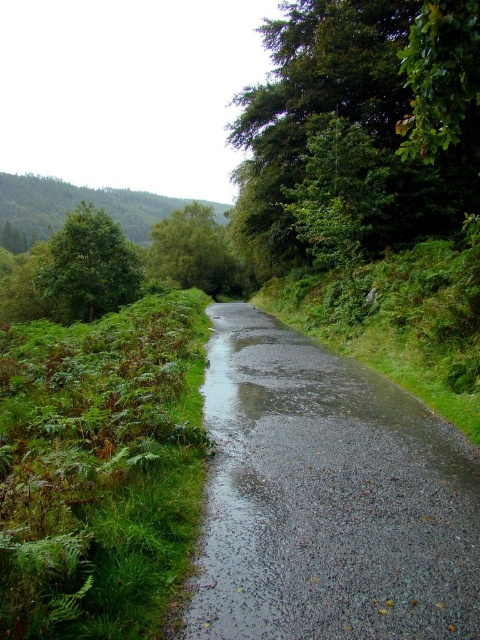
Question: Is green leafy tree at upper right further to camera compared to green leafy tree at center?

Choices:
 (A) yes
 (B) no

Answer: (B)

Question: Does glossy asphalt road at center come behind green leafy tree at left?

Choices:
 (A) no
 (B) yes

Answer: (A)

Question: Which object is farther from the camera taking this photo?

Choices:
 (A) green leafy tree at center
 (B) green leafy tree at left
 (C) green leafy tree at upper right
 (D) glossy asphalt road at center

Answer: (A)

Question: Which point is closer to the camera taking this photo?

Choices:
 (A) (396, 4)
 (B) (58, 246)
 (C) (189, 260)

Answer: (A)

Question: Considering the real-world distances, which object is farthest from the green leafy tree at left?

Choices:
 (A) glossy asphalt road at center
 (B) green leafy tree at center
 (C) green leafy tree at upper right

Answer: (B)

Question: In this image, where is glossy asphalt road at center located relative to green leafy tree at upper right?

Choices:
 (A) right
 (B) left

Answer: (B)